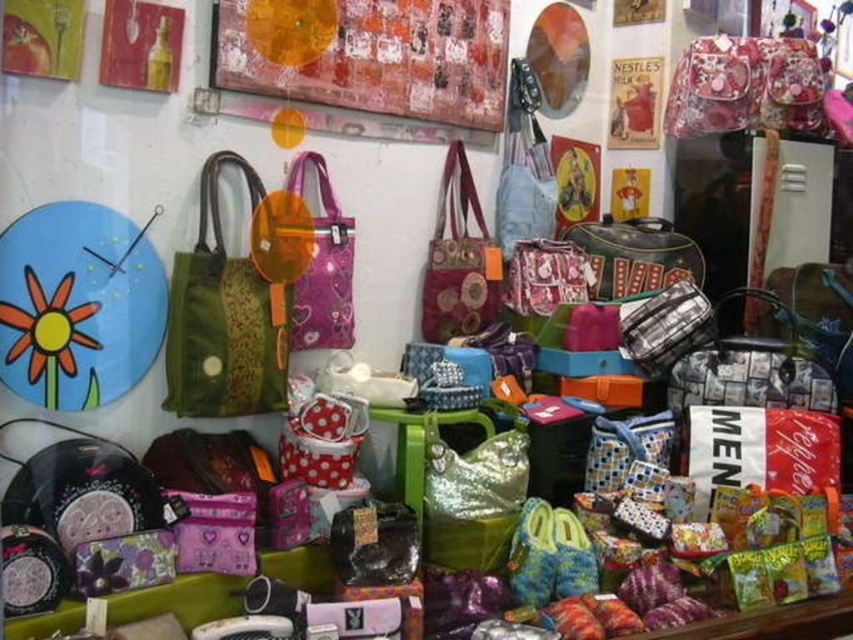
Question: Among these points, which one is nearest to the camera?

Choices:
 (A) (468, 122)
 (B) (505, 464)
 (C) (282, 321)
 (D) (581, 241)

Answer: (C)

Question: Is textured canvas painting at upper center below purple fabric bag at center?

Choices:
 (A) no
 (B) yes

Answer: (A)

Question: Which point is closer to the camera taking this photo?

Choices:
 (A) (212, 378)
 (B) (235, 4)

Answer: (A)

Question: From the image, what is the correct spatial relationship of textured canvas painting at upper center in relation to purple fabric bag at center?

Choices:
 (A) left
 (B) right

Answer: (B)

Question: Does textured canvas painting at upper center have a lesser width compared to shiny gold handbag at center?

Choices:
 (A) yes
 (B) no

Answer: (B)

Question: Which point appears closest to the camera in this image?

Choices:
 (A) (213, 307)
 (B) (349, 244)
 (C) (585, 236)
 (D) (431, 326)

Answer: (A)